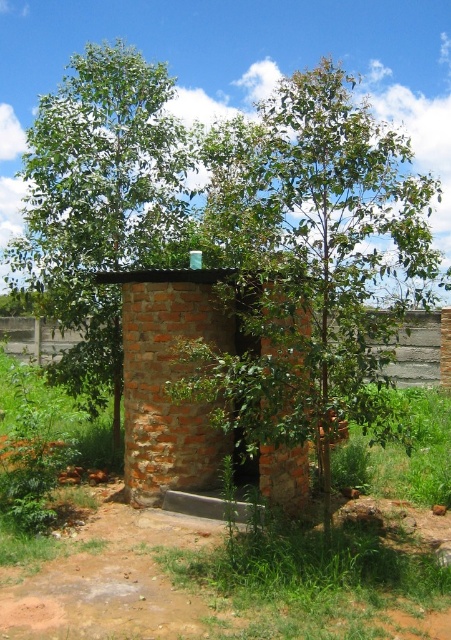
How much distance is there between green leafy tree at center and gray concrete fence at lower center?

green leafy tree at center is 5.39 meters from gray concrete fence at lower center.

Who is more forward, (300, 308) or (412, 355)?

Point (300, 308) is in front.

Where is `green leafy tree at center`? Image resolution: width=451 pixels, height=640 pixels. green leafy tree at center is located at coordinates (312, 257).

Can you confirm if green leafy tree at left is bigger than brick hut at center?

Yes.

Is green leafy tree at left positioned behind brick hut at center?

Yes, it is.

Does point (100, 99) come behind point (146, 413)?

Yes, point (100, 99) is behind point (146, 413).

Image resolution: width=451 pixels, height=640 pixels. Identify the location of green leafy tree at left. (100, 204).

Does green leafy tree at center appear on the right side of brick hut at center?

Indeed, green leafy tree at center is positioned on the right side of brick hut at center.

Is green leafy tree at center further to camera compared to brick hut at center?

No, green leafy tree at center is closer to the viewer.

Which is behind, point (330, 179) or point (174, 406)?

Point (174, 406)

Where is `green leafy tree at center`? Image resolution: width=451 pixels, height=640 pixels. green leafy tree at center is located at coordinates (312, 257).